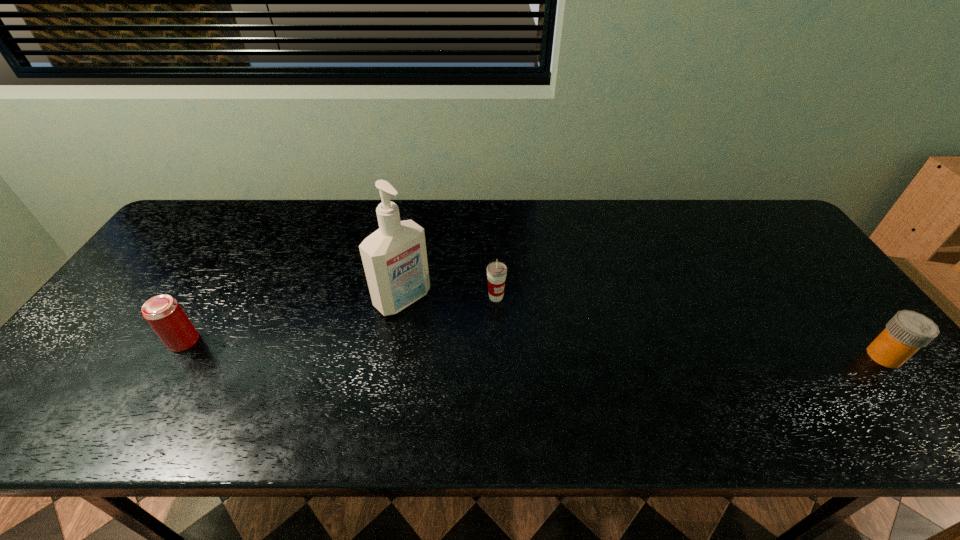
Where is `beer can`? beer can is located at coordinates (163, 313).

Locate an element on the screen. The width and height of the screenshot is (960, 540). the rightmost object is located at coordinates (907, 331).

Locate an element on the screen. the third object from left to right is located at coordinates (496, 271).

Where is `cleansing agent`? cleansing agent is located at coordinates (394, 257).

Where is `the second object from left to right`? This screenshot has width=960, height=540. the second object from left to right is located at coordinates [394, 257].

The height and width of the screenshot is (540, 960). I want to click on free location located on the left of the beer can, so click(96, 341).

The height and width of the screenshot is (540, 960). I want to click on free point located on the side of the cup with the logo, so click(x=591, y=386).

Find the location of `vacant space located on the side of the cup with the logo`. vacant space located on the side of the cup with the logo is located at coordinates (551, 349).

The image size is (960, 540). Identify the location of free space located 0.170m on the side of the cup with the logo. (545, 343).

This screenshot has height=540, width=960. I want to click on free space located on the front label of the second object from left to right, so click(x=452, y=342).